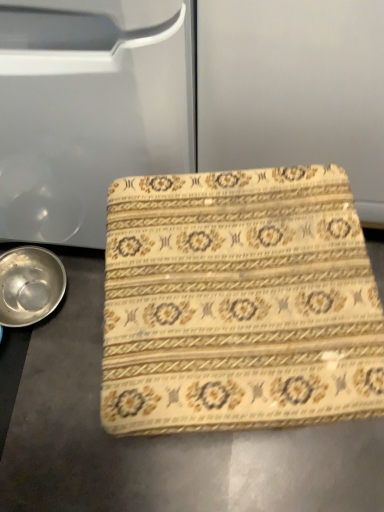
Question: Is beige floral fabric at center wider than metallic silver bowl at lower left?

Choices:
 (A) no
 (B) yes

Answer: (B)

Question: From a real-world perspective, is beige floral fabric at center below metallic silver bowl at lower left?

Choices:
 (A) yes
 (B) no

Answer: (B)

Question: Can you confirm if beige floral fabric at center is bigger than metallic silver bowl at lower left?

Choices:
 (A) no
 (B) yes

Answer: (B)

Question: Is beige floral fabric at center to the left of metallic silver bowl at lower left from the viewer's perspective?

Choices:
 (A) no
 (B) yes

Answer: (A)

Question: Can you confirm if beige floral fabric at center is positioned to the right of metallic silver bowl at lower left?

Choices:
 (A) no
 (B) yes

Answer: (B)

Question: Considering the relative sizes of beige floral fabric at center and metallic silver bowl at lower left in the image provided, is beige floral fabric at center shorter than metallic silver bowl at lower left?

Choices:
 (A) yes
 (B) no

Answer: (B)

Question: Can you confirm if metallic silver bowl at lower left is taller than beige floral fabric at center?

Choices:
 (A) yes
 (B) no

Answer: (B)

Question: Considering the relative sizes of metallic silver bowl at lower left and beige floral fabric at center in the image provided, is metallic silver bowl at lower left wider than beige floral fabric at center?

Choices:
 (A) no
 (B) yes

Answer: (A)

Question: Considering the relative sizes of metallic silver bowl at lower left and beige floral fabric at center in the image provided, is metallic silver bowl at lower left thinner than beige floral fabric at center?

Choices:
 (A) yes
 (B) no

Answer: (A)

Question: Does metallic silver bowl at lower left have a smaller size compared to beige floral fabric at center?

Choices:
 (A) yes
 (B) no

Answer: (A)

Question: Is metallic silver bowl at lower left looking in the opposite direction of beige floral fabric at center?

Choices:
 (A) no
 (B) yes

Answer: (A)

Question: Does metallic silver bowl at lower left come behind beige floral fabric at center?

Choices:
 (A) yes
 (B) no

Answer: (A)

Question: Would you say metallic silver bowl at lower left is inside or outside beige floral fabric at center?

Choices:
 (A) inside
 (B) outside

Answer: (B)